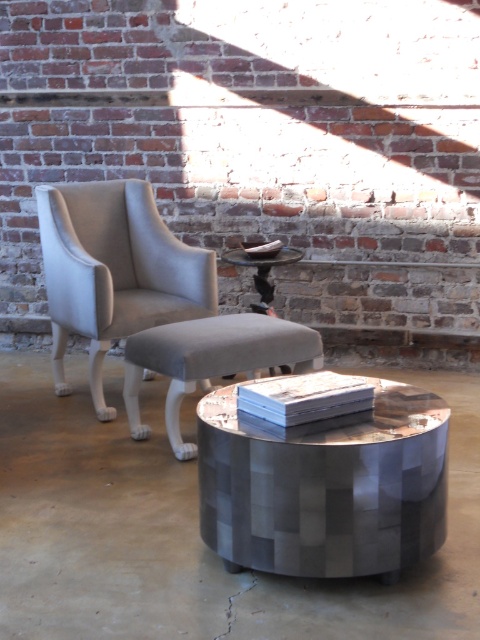
Question: Among these objects, which one is farthest from the camera?

Choices:
 (A) metallic polished side table at center
 (B) matte gray stool at center
 (C) metallic mosaic table at center

Answer: (A)

Question: Is light gray fabric armchair at center thinner than matte gray stool at center?

Choices:
 (A) no
 (B) yes

Answer: (A)

Question: Does metallic mosaic table at center have a greater width compared to matte gray stool at center?

Choices:
 (A) yes
 (B) no

Answer: (B)

Question: Is light gray fabric armchair at center above matte gray stool at center?

Choices:
 (A) no
 (B) yes

Answer: (B)

Question: Which is farther from the light gray fabric armchair at center?

Choices:
 (A) metallic mosaic table at center
 (B) metallic polished side table at center

Answer: (A)

Question: Which point is farther from the camera taking this photo?

Choices:
 (A) (280, 248)
 (B) (71, 232)
 (C) (418, 404)
 (D) (204, 320)

Answer: (A)